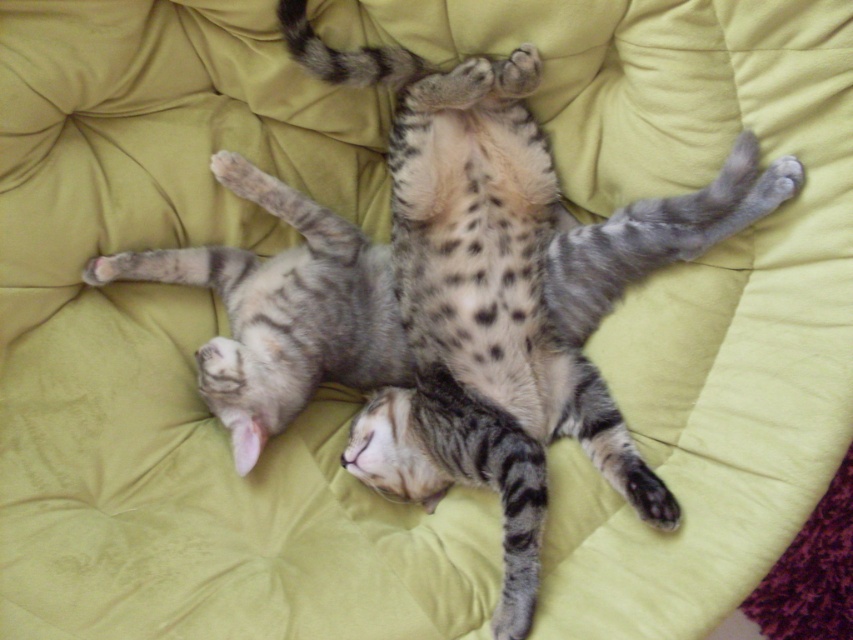
Question: Is spotted fur cat at center smaller than tabby fur cat at center?

Choices:
 (A) yes
 (B) no

Answer: (B)

Question: Which object is farther from the camera taking this photo?

Choices:
 (A) tabby fur cat at center
 (B) spotted fur cat at center

Answer: (A)

Question: From the image, what is the correct spatial relationship of spotted fur cat at center in relation to tabby fur cat at center?

Choices:
 (A) below
 (B) above

Answer: (B)

Question: Among these points, which one is nearest to the camera?

Choices:
 (A) pos(403,394)
 (B) pos(219,355)

Answer: (B)

Question: Can you confirm if spotted fur cat at center is wider than tabby fur cat at center?

Choices:
 (A) no
 (B) yes

Answer: (B)